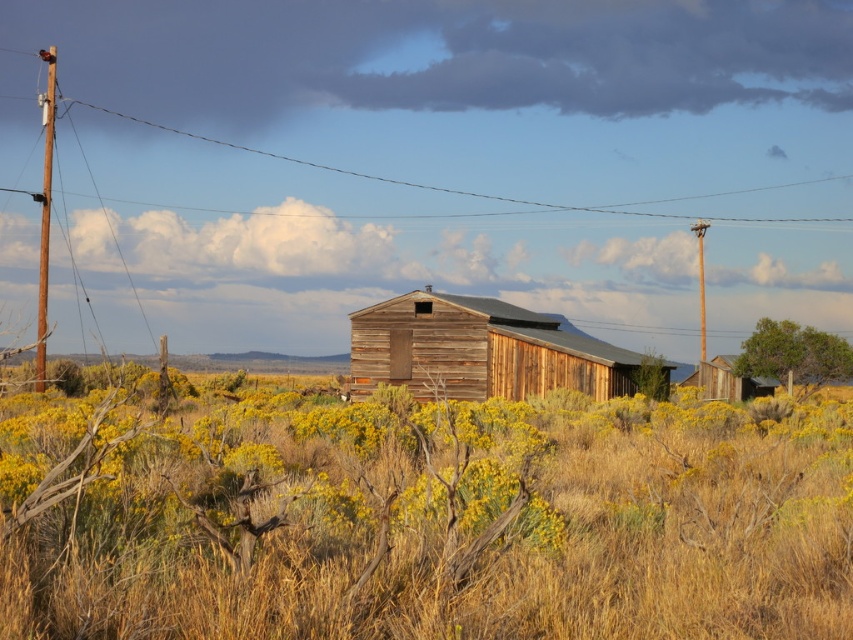
Who is lower down, weathered wood barn at center or brown wooden telegraph pole at right?

weathered wood barn at center is below.

Describe the element at coordinates (479, 352) in the screenshot. I see `weathered wood barn at center` at that location.

The image size is (853, 640). Find the location of `weathered wood barn at center`. weathered wood barn at center is located at coordinates (479, 352).

Is wooden telegraph pole at left below brown wooden telegraph pole at right?

Actually, wooden telegraph pole at left is above brown wooden telegraph pole at right.

In the scene shown: Is wooden telegraph pole at left shorter than brown wooden telegraph pole at right?

In fact, wooden telegraph pole at left may be taller than brown wooden telegraph pole at right.

Which is in front, point (35, 356) or point (701, 323)?

Positioned in front is point (35, 356).

Locate an element on the screen. The width and height of the screenshot is (853, 640). wooden telegraph pole at left is located at coordinates (45, 212).

Does wooden telegraph pole at left have a lesser width compared to wooden hut at right?

No, wooden telegraph pole at left is not thinner than wooden hut at right.

Can you confirm if wooden telegraph pole at left is shorter than wooden hut at right?

No.

This screenshot has height=640, width=853. What do you see at coordinates (45, 212) in the screenshot?
I see `wooden telegraph pole at left` at bounding box center [45, 212].

Where is `wooden telegraph pole at left`? wooden telegraph pole at left is located at coordinates (45, 212).